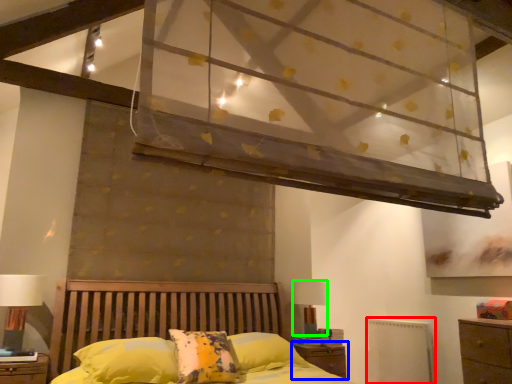
Question: Which object is the closest to the radiator (highlighted by a red box)? Choose among these: nightstand (highlighted by a blue box) or table lamp (highlighted by a green box).

Choices:
 (A) nightstand
 (B) table lamp

Answer: (A)